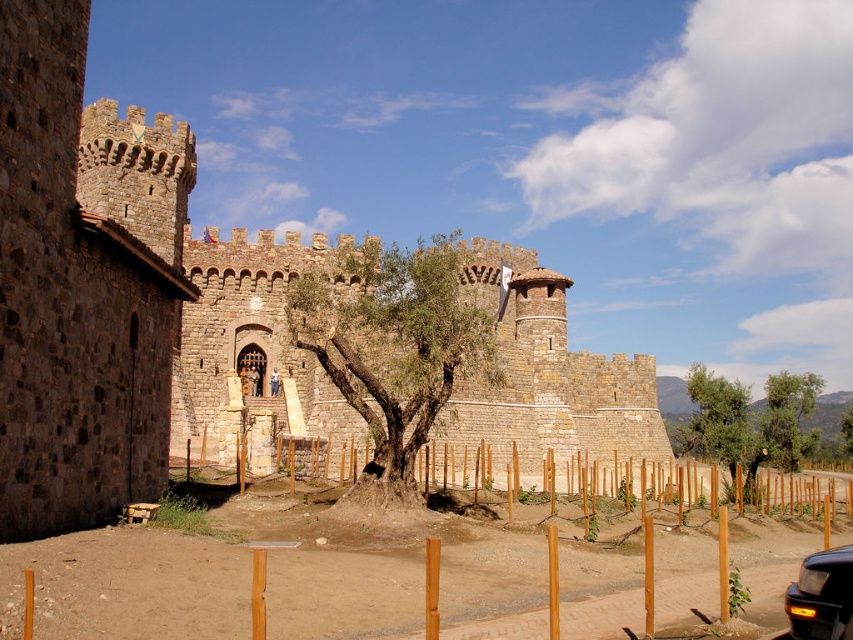
Question: Which point appears farthest from the camera in this image?

Choices:
 (A) (328, 316)
 (B) (238, 278)
 (C) (805, 435)
 (D) (817, 577)

Answer: (B)

Question: In this image, where is green rough bark tree at center located relative to green leafy tree at upper right?

Choices:
 (A) left
 (B) right

Answer: (A)

Question: Considering the real-world distances, which object is farthest from the brown stone castle at center?

Choices:
 (A) green leafy tree at lower right
 (B) green rough bark tree at center
 (C) metallic gray car at lower right

Answer: (A)

Question: Is brown stone castle at center to the right of green leafy tree at upper right from the viewer's perspective?

Choices:
 (A) yes
 (B) no

Answer: (B)

Question: Which point is farther from the camera taking this photo?

Choices:
 (A) (263, 243)
 (B) (798, 397)
 (C) (479, 317)
 (D) (727, 435)

Answer: (A)

Question: Does brown stone castle at center appear on the left side of green leafy tree at upper right?

Choices:
 (A) no
 (B) yes

Answer: (B)